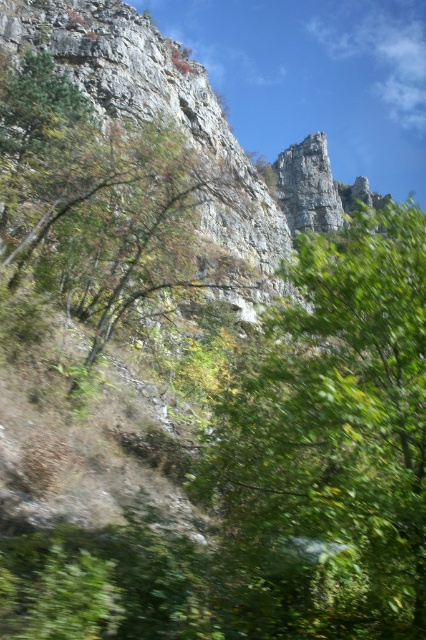
You are a bird looking for a nesting spot. You see the green leafy tree at center and the green leafy tree at upper left. Which tree is shorter and better for a small nest?

The green leafy tree at center is shorter than the green leafy tree at upper left, so it is better for a small nest.

You are an environmental scientist assessing the cliff area. You notice two green leafy trees in the scene. Which tree has a larger width? The options are the green leafy tree at center and the green leafy tree at upper left.

The green leafy tree at center has a larger width than the green leafy tree at upper left according to the description.